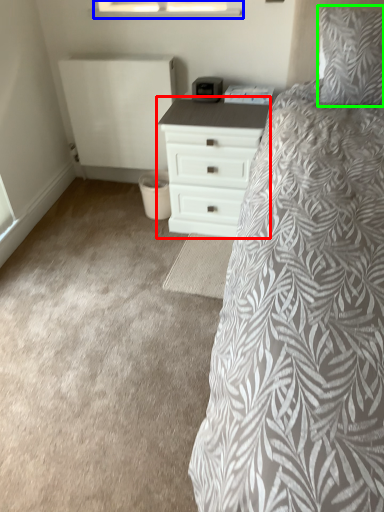
Question: Based on their relative distances, which object is farther from chest of drawers (highlighted by a red box)? Choose from window (highlighted by a blue box) and pillow (highlighted by a green box).

Choices:
 (A) window
 (B) pillow

Answer: (A)